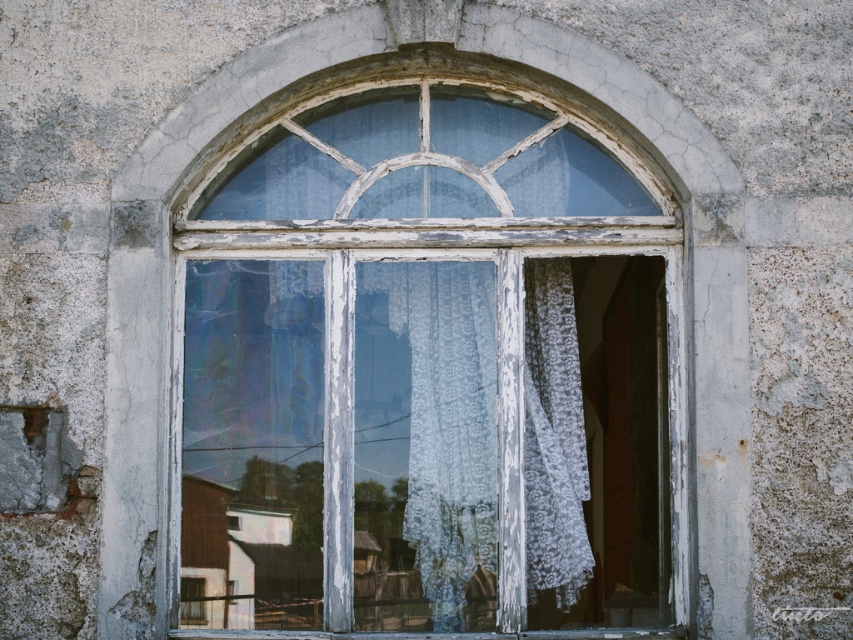
Question: Does white peeling paint at center have a smaller size compared to white lace curtain at center?

Choices:
 (A) no
 (B) yes

Answer: (A)

Question: Is white peeling paint at center wider than white lace curtain at center?

Choices:
 (A) no
 (B) yes

Answer: (B)

Question: Can you confirm if white peeling paint at center is thinner than white lace curtain at center?

Choices:
 (A) no
 (B) yes

Answer: (A)

Question: Among these points, which one is farthest from the camera?

Choices:
 (A) (467, 292)
 (B) (395, 218)

Answer: (A)

Question: Which point is closer to the camera?

Choices:
 (A) white lace curtain at center
 (B) white peeling paint at center

Answer: (B)